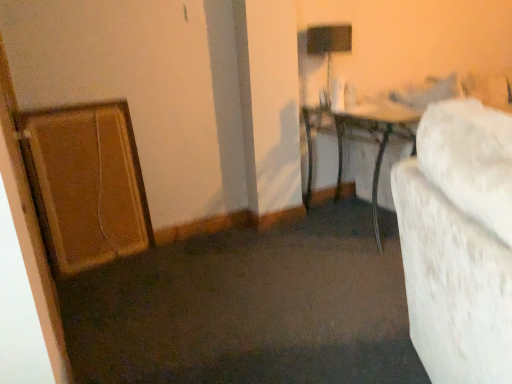
Image resolution: width=512 pixels, height=384 pixels. What do you see at coordinates (329, 45) in the screenshot? I see `black matte table lamp at upper center` at bounding box center [329, 45].

You are a GUI agent. You are given a task and a screenshot of the screen. Output one action in this format:
    pyautogui.click(x=<x>, y=<y>)
    Task: Click on the black matte table lamp at upper center
    Image resolution: width=512 pixels, height=384 pixels.
    Given the screenshot: What is the action you would take?
    pyautogui.click(x=329, y=45)

What are the coordinates of `metallic silver table at center` in the screenshot? It's located at (375, 139).

What do you see at coordinates (375, 139) in the screenshot? Image resolution: width=512 pixels, height=384 pixels. I see `metallic silver table at center` at bounding box center [375, 139].

Locate an element on the screen. The image size is (512, 384). black matte table lamp at upper center is located at coordinates (329, 45).

Between black matte table lamp at upper center and metallic silver table at center, which one appears on the left side from the viewer's perspective?

Positioned to the left is black matte table lamp at upper center.

Is the depth of black matte table lamp at upper center greater than that of metallic silver table at center?

Yes, the depth of black matte table lamp at upper center is greater than that of metallic silver table at center.

Which is nearer, [310,38] or [384,141]?

The point [384,141] is more forward.

From the image's perspective, is black matte table lamp at upper center on top of metallic silver table at center?

Yes, from the image's perspective, black matte table lamp at upper center is over metallic silver table at center.

From a real-world perspective, is black matte table lamp at upper center below metallic silver table at center?

No, from a real-world perspective, black matte table lamp at upper center is not beneath metallic silver table at center.

Between black matte table lamp at upper center and metallic silver table at center, which one has smaller width?

With smaller width is black matte table lamp at upper center.

Considering the sizes of black matte table lamp at upper center and metallic silver table at center in the image, is black matte table lamp at upper center taller or shorter than metallic silver table at center?

Considering their sizes, black matte table lamp at upper center has less height than metallic silver table at center.

Is black matte table lamp at upper center bigger than metallic silver table at center?

Actually, black matte table lamp at upper center might be smaller than metallic silver table at center.

Could metallic silver table at center be considered to be inside black matte table lamp at upper center?

No, black matte table lamp at upper center does not contain metallic silver table at center.

Is there a large distance between black matte table lamp at upper center and metallic silver table at center?

black matte table lamp at upper center is actually quite close to metallic silver table at center.

Is black matte table lamp at upper center aimed at metallic silver table at center?

No, black matte table lamp at upper center does not turn towards metallic silver table at center.

From the picture: What's the angular difference between black matte table lamp at upper center and metallic silver table at center's facing directions?

They differ by 2.73 degrees in their facing directions.

How distant is black matte table lamp at upper center from metallic silver table at center?

black matte table lamp at upper center is 17.95 inches from metallic silver table at center.

Locate an element on the screen. The height and width of the screenshot is (384, 512). table lamp above the metallic silver table at center (from the image's perspective) is located at coordinates (329, 45).

Based on the photo, considering the relative positions of metallic silver table at center and black matte table lamp at upper center in the image provided, is metallic silver table at center to the left of black matte table lamp at upper center from the viewer's perspective?

Incorrect, metallic silver table at center is not on the left side of black matte table lamp at upper center.

Is metallic silver table at center positioned before black matte table lamp at upper center?

Yes, it is.

Which is behind, point (403, 125) or point (307, 36)?

Point (307, 36)

From the image's perspective, who appears lower, metallic silver table at center or black matte table lamp at upper center?

metallic silver table at center is shown below in the image.

From a real-world perspective, who is located higher, metallic silver table at center or black matte table lamp at upper center?

black matte table lamp at upper center, from a real-world perspective.

Can you confirm if metallic silver table at center is thinner than black matte table lamp at upper center?

No.

Which of these two, metallic silver table at center or black matte table lamp at upper center, stands shorter?

With less height is black matte table lamp at upper center.

From the picture: Looking at the image, does metallic silver table at center seem bigger or smaller compared to black matte table lamp at upper center?

In the image, metallic silver table at center appears to be larger than black matte table lamp at upper center.

Can black matte table lamp at upper center be found inside metallic silver table at center?

Actually, black matte table lamp at upper center is outside metallic silver table at center.

In the scene shown: Is metallic silver table at center positioned far away from black matte table lamp at upper center?

No, there isn't a large distance between metallic silver table at center and black matte table lamp at upper center.

Is metallic silver table at center facing away from black matte table lamp at upper center?

No.

What's the angular difference between metallic silver table at center and black matte table lamp at upper center's facing directions?

2.73 degrees.

How far apart are metallic silver table at center and black matte table lamp at upper center?

The distance of metallic silver table at center from black matte table lamp at upper center is 17.95 inches.

Identify the location of table in front of the black matte table lamp at upper center. The image size is (512, 384). [375, 139].

The width and height of the screenshot is (512, 384). What are the coordinates of `table that appears on the right of black matte table lamp at upper center` in the screenshot? It's located at [x=375, y=139].

At what (x,y) coordinates should I click in order to perform the action: click on table below the black matte table lamp at upper center (from a real-world perspective). Please return your answer as a coordinate pair (x, y). Image resolution: width=512 pixels, height=384 pixels. Looking at the image, I should click on (375, 139).